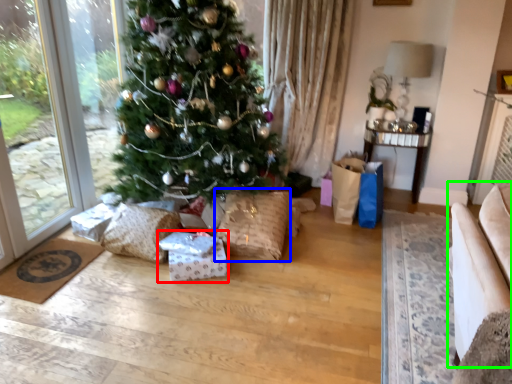
Question: Which is farther away from package (highlighted by a red box)? pillow (highlighted by a blue box) or armchair (highlighted by a green box)?

Choices:
 (A) pillow
 (B) armchair

Answer: (B)